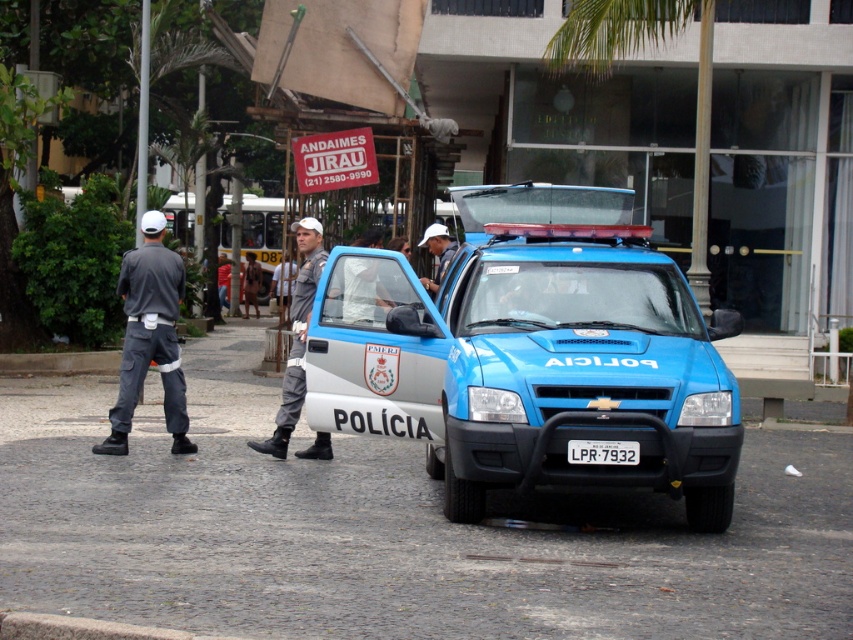
Who is taller, white plastic license plate at center or white matte cap at center?

white matte cap at center is taller.

Between point (601, 449) and point (440, 227), which one is positioned in front?

Positioned in front is point (601, 449).

In order to click on white plastic license plate at center in this screenshot , I will do `click(602, 451)`.

Between point (306, 241) and point (428, 291), which one is positioned behind?

Point (428, 291)

Is gray uniform pants at center positioned in front of white matte cap at center?

No, gray uniform pants at center is further to the viewer.

Locate an element on the screen. gray uniform pants at center is located at coordinates (296, 336).

At what (x,y) coordinates should I click in order to perform the action: click on gray uniform pants at center. Please return your answer as a coordinate pair (x, y). Looking at the image, I should click on (296, 336).

Which is in front, point (180, 260) or point (294, 403)?

Positioned in front is point (294, 403).

Does point (152, 275) come farther from viewer compared to point (303, 380)?

Yes, it is.

Does point (144, 340) come closer to viewer compared to point (321, 452)?

Yes.

Where is `dark gray uniform at left`? The width and height of the screenshot is (853, 640). dark gray uniform at left is located at coordinates (149, 337).